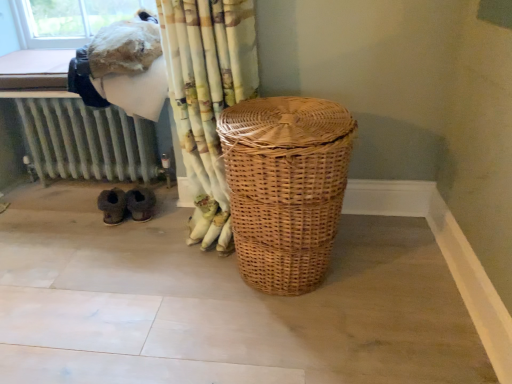
I want to click on vacant space situated on the left part of woven brown laundry basket at center, so click(x=164, y=311).